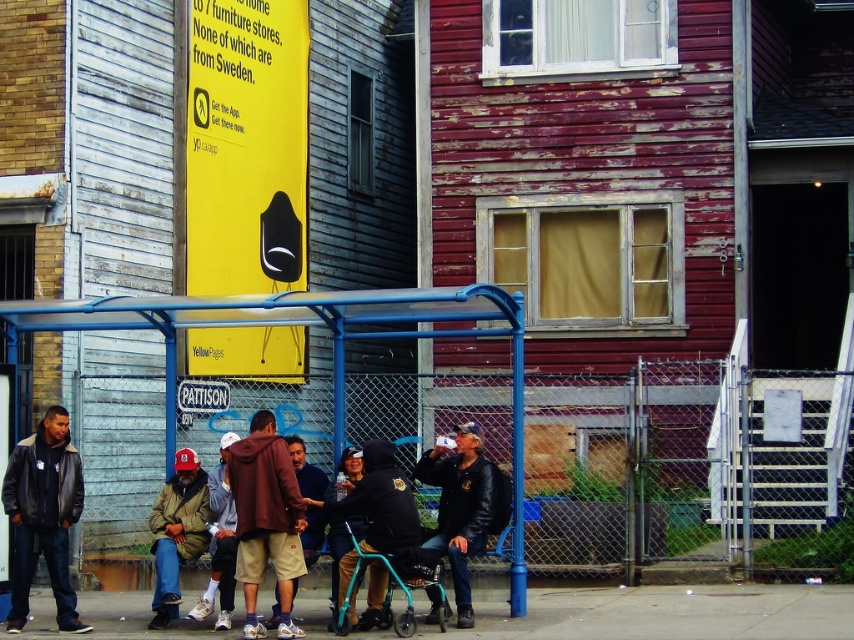
From the picture: Can you confirm if blue metal bus stop at center is wider than teal plastic walker at center?

Indeed, blue metal bus stop at center has a greater width compared to teal plastic walker at center.

Which is behind, point (262, 310) or point (445, 628)?

The point (262, 310) is behind.

Is point (185, 305) closer to viewer compared to point (442, 592)?

No, it is behind (442, 592).

The image size is (854, 640). I want to click on blue metal bus stop at center, so click(x=291, y=323).

Can you confirm if concrete pavement at lower center is bigger than leather jacket at left?

Correct, concrete pavement at lower center is larger in size than leather jacket at left.

Locate an element on the screen. concrete pavement at lower center is located at coordinates (670, 612).

Which is behind, point (601, 627) or point (34, 496)?

Point (34, 496)

Find the location of `concrete pavement at lower center`. concrete pavement at lower center is located at coordinates (670, 612).

Can you confirm if leather jacket at left is positioned above maroon hoodie at center?

Incorrect, leather jacket at left is not positioned above maroon hoodie at center.

Is point (73, 605) in front of point (272, 413)?

No, (73, 605) is further to viewer.

The image size is (854, 640). Identify the location of leather jacket at left. (44, 515).